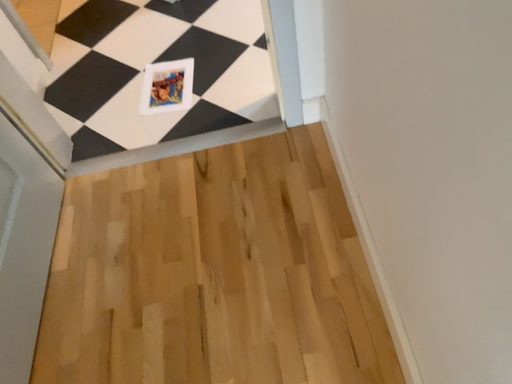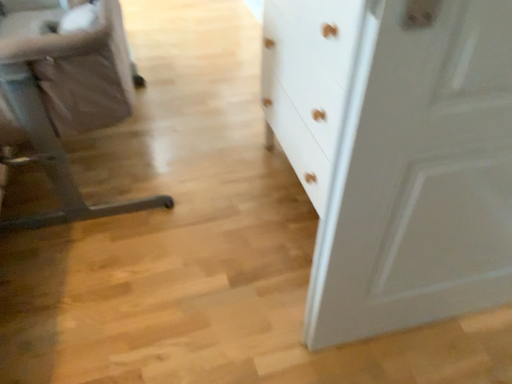
Question: Which way did the camera rotate in the video?

Choices:
 (A) rotated downward
 (B) rotated upward

Answer: (B)